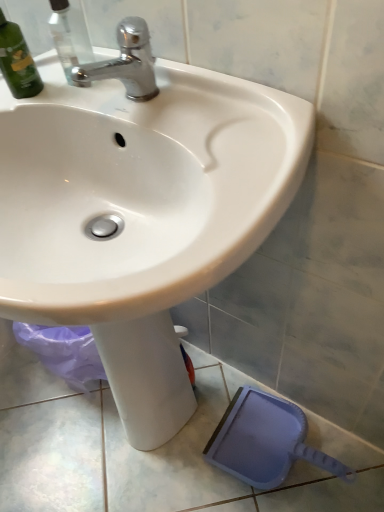
Image resolution: width=384 pixels, height=512 pixels. I want to click on green matte bottle at upper left, so click(17, 61).

Measure the distance between point [73,80] and camera.

21.38 inches.

This screenshot has height=512, width=384. In order to click on green matte bottle at upper left in this screenshot , I will do `click(17, 61)`.

Considering the relative positions of green matte bottle at upper left and chrome metallic faucet at upper center in the image provided, is green matte bottle at upper left in front of chrome metallic faucet at upper center?

No, it is behind chrome metallic faucet at upper center.

Is green matte bottle at upper left not close to chrome metallic faucet at upper center?

No, green matte bottle at upper left is not far away from chrome metallic faucet at upper center.

Where is `bottle on the left of chrome metallic faucet at upper center`? bottle on the left of chrome metallic faucet at upper center is located at coordinates (17, 61).

Looking at this image, is white glossy sink at upper center taller or shorter than green matte bottle at upper left?

Considering their sizes, white glossy sink at upper center has more height than green matte bottle at upper left.

Could green matte bottle at upper left be considered to be inside white glossy sink at upper center?

No, green matte bottle at upper left is located outside of white glossy sink at upper center.

Is white glossy sink at upper center in front of green matte bottle at upper left?

That is True.

In the scene shown: Is white glossy sink at upper center wider than green matte bottle at upper left?

Yes, white glossy sink at upper center is wider than green matte bottle at upper left.

Is the position of white glossy sink at upper center more distant than that of chrome metallic faucet at upper center?

No, the depth of white glossy sink at upper center is less than that of chrome metallic faucet at upper center.

Between white glossy sink at upper center and chrome metallic faucet at upper center, which one has less height?

With less height is chrome metallic faucet at upper center.

Is white glossy sink at upper center oriented away from chrome metallic faucet at upper center?

No, white glossy sink at upper center's orientation is not away from chrome metallic faucet at upper center.

Considering the sizes of white glossy sink at upper center and chrome metallic faucet at upper center in the image, is white glossy sink at upper center bigger or smaller than chrome metallic faucet at upper center?

In the image, white glossy sink at upper center appears to be larger than chrome metallic faucet at upper center.

Consider the image. Who is smaller, chrome metallic faucet at upper center or green matte bottle at upper left?

Smaller between the two is chrome metallic faucet at upper center.

Looking at their sizes, would you say chrome metallic faucet at upper center is wider or thinner than green matte bottle at upper left?

In the image, chrome metallic faucet at upper center appears to be more narrow than green matte bottle at upper left.

Is chrome metallic faucet at upper center at the left side of green matte bottle at upper left?

No.

From a real-world perspective, does chrome metallic faucet at upper center sit lower than green matte bottle at upper left?

Yes, from a real-world perspective, chrome metallic faucet at upper center is below green matte bottle at upper left.

Between green matte bottle at upper left and white glossy sink at upper center, which one appears on the left side from the viewer's perspective?

green matte bottle at upper left.

From the image's perspective, would you say green matte bottle at upper left is positioned over white glossy sink at upper center?

Indeed, from the image's perspective, green matte bottle at upper left is shown above white glossy sink at upper center.

From a real-world perspective, which is physically below, green matte bottle at upper left or white glossy sink at upper center?

white glossy sink at upper center is physically lower.

How much distance is there between chrome metallic faucet at upper center and white glossy sink at upper center?

They are 10.43 inches apart.

Which of these two, chrome metallic faucet at upper center or white glossy sink at upper center, is bigger?

white glossy sink at upper center is bigger.

From the picture: In terms of height, does chrome metallic faucet at upper center look taller or shorter compared to white glossy sink at upper center?

Clearly, chrome metallic faucet at upper center is shorter compared to white glossy sink at upper center.

Which is behind, chrome metallic faucet at upper center or white glossy sink at upper center?

Positioned behind is chrome metallic faucet at upper center.

You are a GUI agent. You are given a task and a screenshot of the screen. Output one action in this format:
    pyautogui.click(x=<x>, y=<y>)
    Task: Click on the bottle lying behind the chrome metallic faucet at upper center
    
    Given the screenshot: What is the action you would take?
    pyautogui.click(x=17, y=61)

The width and height of the screenshot is (384, 512). Find the location of `sink below the green matte bottle at upper left (from the image's perspective)`. sink below the green matte bottle at upper left (from the image's perspective) is located at coordinates (140, 213).

From the image, which object appears to be nearer to chrome metallic faucet at upper center, green matte bottle at upper left or white glossy sink at upper center?

green matte bottle at upper left lies closer to chrome metallic faucet at upper center than the other object.

When comparing their distances from chrome metallic faucet at upper center, does white glossy sink at upper center or green matte bottle at upper left seem closer?

green matte bottle at upper left is closer to chrome metallic faucet at upper center.

Based on their spatial positions, is white glossy sink at upper center or chrome metallic faucet at upper center further from green matte bottle at upper left?

white glossy sink at upper center is further to green matte bottle at upper left.

Looking at the image, which one is located further to white glossy sink at upper center, green matte bottle at upper left or chrome metallic faucet at upper center?

Based on the image, green matte bottle at upper left appears to be further to white glossy sink at upper center.

Looking at the image, which one is located further to white glossy sink at upper center, chrome metallic faucet at upper center or green matte bottle at upper left?

green matte bottle at upper left lies further to white glossy sink at upper center than the other object.

Considering their positions, is chrome metallic faucet at upper center positioned closer to green matte bottle at upper left than white glossy sink at upper center?

Based on the image, chrome metallic faucet at upper center appears to be nearer to green matte bottle at upper left.

I want to click on tap between green matte bottle at upper left and white glossy sink at upper center in the vertical direction, so click(x=125, y=62).